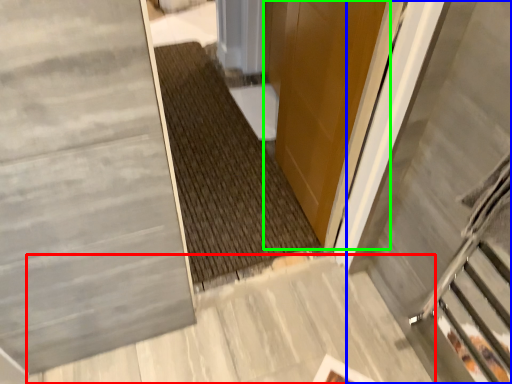
Question: Which object is positioned closest to concrete (highlighted by a red box)? Select from escalator (highlighted by a blue box) and door (highlighted by a green box).

Choices:
 (A) escalator
 (B) door

Answer: (A)